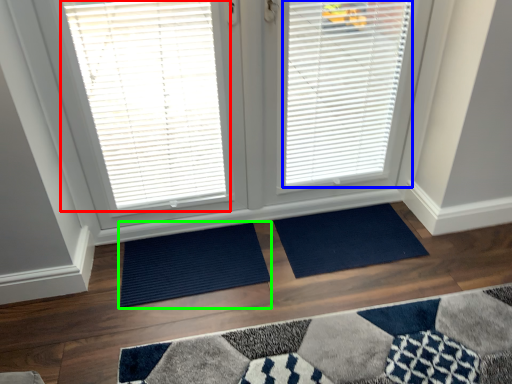
Question: Which is farther away from window blind (highlighted by a red box)? window blind (highlighted by a blue box) or doormat (highlighted by a green box)?

Choices:
 (A) window blind
 (B) doormat

Answer: (B)